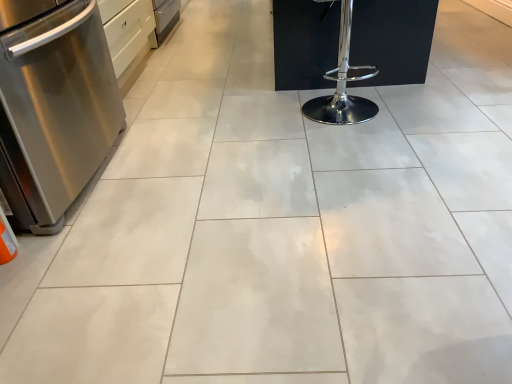
Question: Considering the positions of chrome/metallic bar stool at center-right and stainless steel dishwasher at left in the image, is chrome/metallic bar stool at center-right wider or thinner than stainless steel dishwasher at left?

Choices:
 (A) thin
 (B) wide

Answer: (A)

Question: Considering their positions, is chrome/metallic bar stool at center-right located in front of or behind stainless steel dishwasher at left?

Choices:
 (A) front
 (B) behind

Answer: (B)

Question: Based on their sizes in the image, would you say chrome/metallic bar stool at center-right is bigger or smaller than stainless steel dishwasher at left?

Choices:
 (A) small
 (B) big

Answer: (A)

Question: In terms of height, does stainless steel dishwasher at left look taller or shorter compared to chrome/metallic bar stool at center-right?

Choices:
 (A) tall
 (B) short

Answer: (A)

Question: Which is correct: stainless steel dishwasher at left is inside chrome/metallic bar stool at center-right, or outside of it?

Choices:
 (A) outside
 (B) inside

Answer: (A)

Question: Is point (17, 172) closer or farther from the camera than point (293, 61)?

Choices:
 (A) farther
 (B) closer

Answer: (B)

Question: From the image's perspective, relative to chrome/metallic bar stool at center-right, is stainless steel dishwasher at left above or below?

Choices:
 (A) above
 (B) below

Answer: (B)